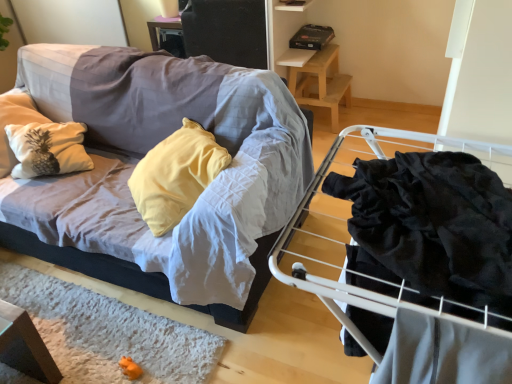
Locate an element on the screen. The image size is (512, 384). vacant space situated above black velvet fabric at right (from a real-world perspective) is located at coordinates (432, 213).